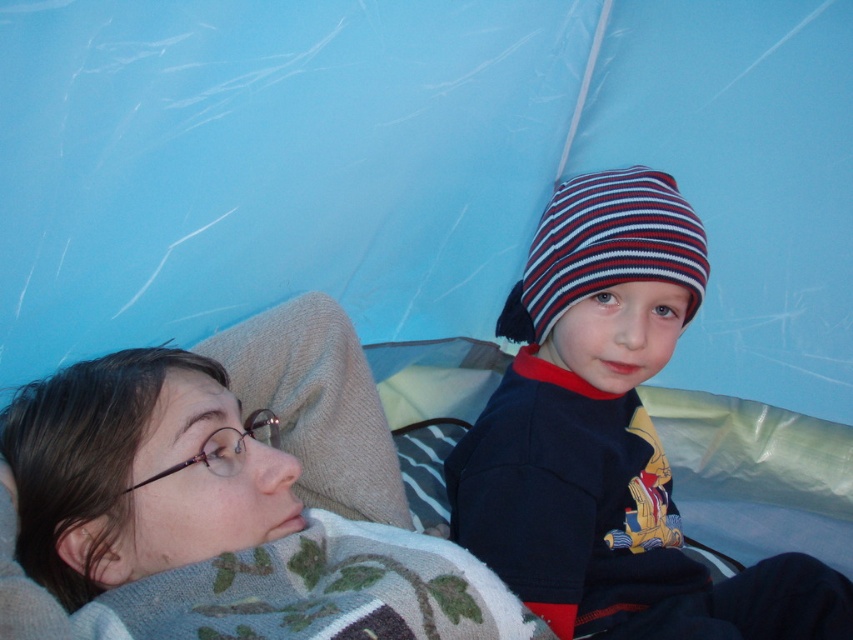
Can you confirm if striped knit hat at upper right is wider than striped knit beanie at center?

Indeed, striped knit hat at upper right has a greater width compared to striped knit beanie at center.

Between point (619, 234) and point (553, 292), which one is positioned in front?

Positioned in front is point (619, 234).

This screenshot has width=853, height=640. In order to click on striped knit hat at upper right in this screenshot , I will do `click(610, 438)`.

Who is lower down, blue fabric tent at upper center or striped knit beanie at center?

striped knit beanie at center is below.

Does point (235, 308) come in front of point (637, 276)?

That is False.

Find the location of a particular element. The width and height of the screenshot is (853, 640). blue fabric tent at upper center is located at coordinates (416, 168).

Is blue fabric tent at upper center to the left of striped knit hat at upper right from the viewer's perspective?

Yes, blue fabric tent at upper center is to the left of striped knit hat at upper right.

Between blue fabric tent at upper center and striped knit hat at upper right, which one has more height?

Standing taller between the two is blue fabric tent at upper center.

Locate an element on the screen. blue fabric tent at upper center is located at coordinates (416, 168).

Image resolution: width=853 pixels, height=640 pixels. I want to click on blue fabric tent at upper center, so click(416, 168).